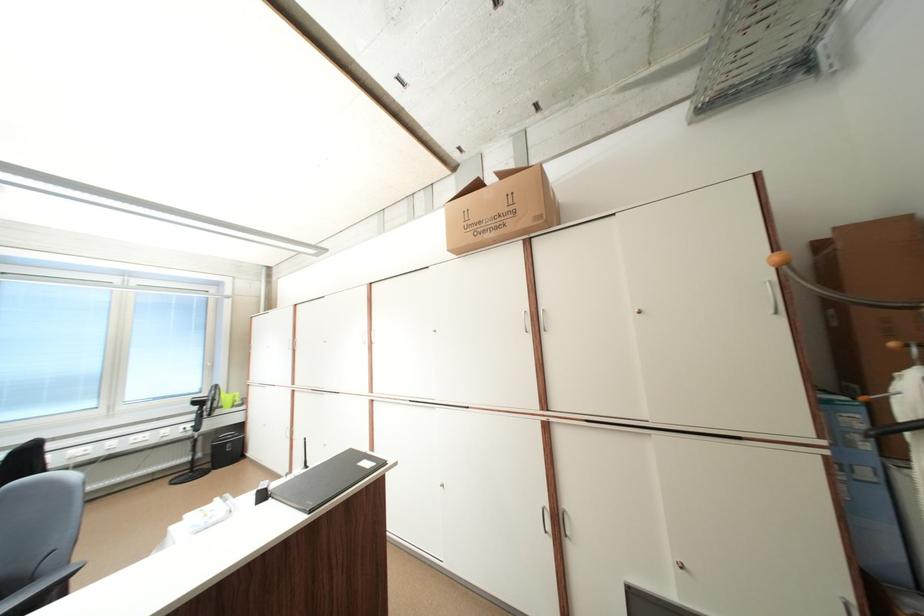
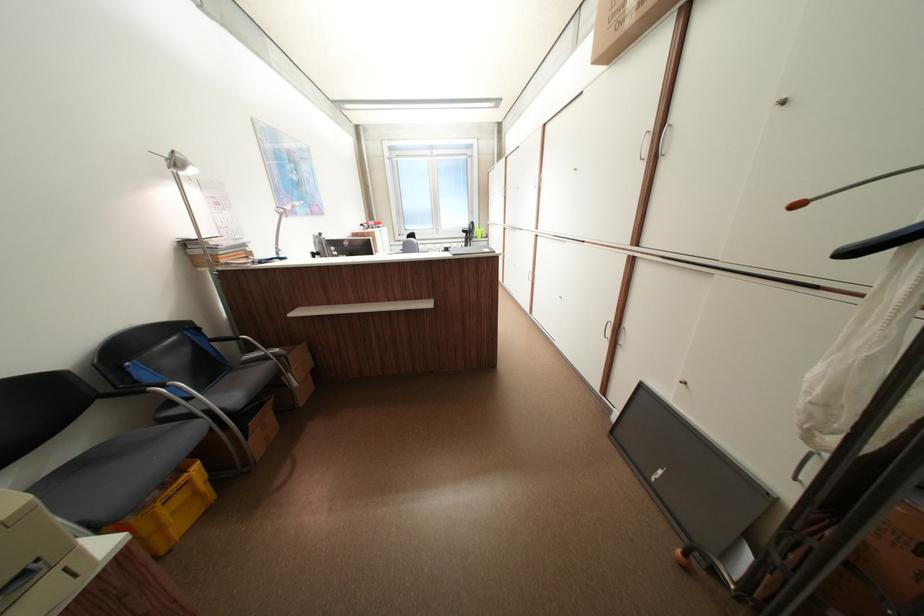
Locate, in the second image, the point that corresponds to [558,528] in the first image.

(618, 336)